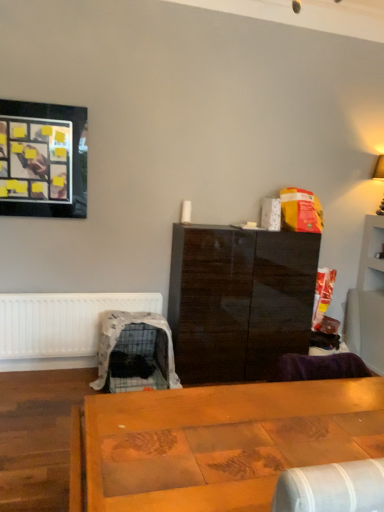
The image size is (384, 512). I want to click on blank space above white matte radiator at lower left (from a real-world perspective), so click(57, 293).